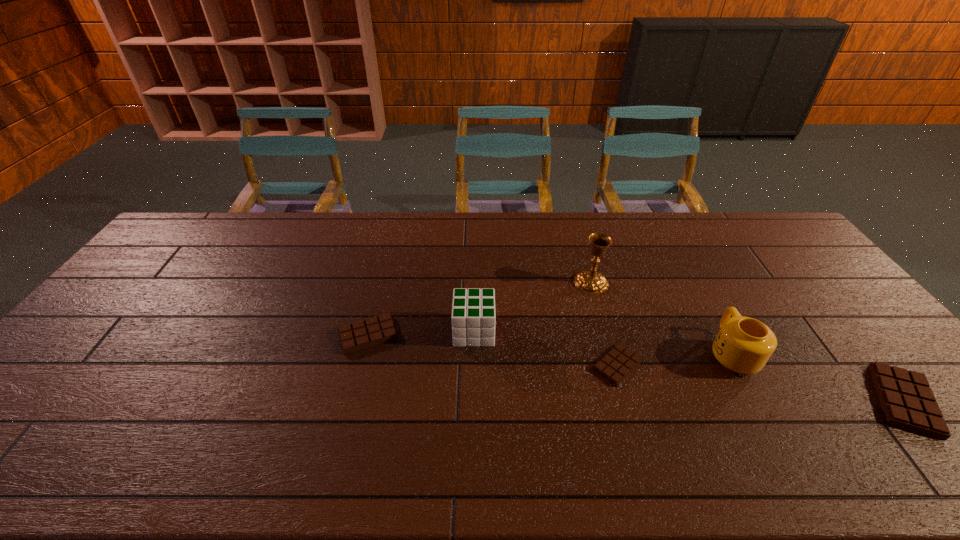
The height and width of the screenshot is (540, 960). In the image, there is a desktop. Identify the location of vacant space at the far right corner. (774, 224).

Locate an element on the screen. This screenshot has width=960, height=540. vacant region between the cube and the fifth object from left to right is located at coordinates (603, 342).

Find the location of a particular element. The image size is (960, 540). empty location between the farthest object and the shortest candy bar is located at coordinates (605, 324).

Where is `free space between the fifth object from right to left and the second candy bar from left to right`? This screenshot has width=960, height=540. free space between the fifth object from right to left and the second candy bar from left to right is located at coordinates (546, 348).

In order to click on vacant space that's between the fifth object from left to right and the chalice in this screenshot , I will do `click(661, 318)`.

Find the location of a particular element. The width and height of the screenshot is (960, 540). vacant area that lies between the second object from left to right and the mug is located at coordinates (603, 342).

Locate an element on the screen. The width and height of the screenshot is (960, 540). vacant area that lies between the second object from right to left and the tallest object is located at coordinates (661, 318).

At what (x,y) coordinates should I click in order to perform the action: click on vacant area between the cube and the farthest object. Please return your answer as a coordinate pair (x, y). The image size is (960, 540). Looking at the image, I should click on (533, 307).

In order to click on empty location between the mug and the second tallest candy bar in this screenshot , I will do `click(550, 344)`.

Locate which object ranks second in proximity to the second candy bar from left to right. Please provide its 2D coordinates. Your answer should be formatted as a tuple, i.e. [(x, y)], where the tuple contains the x and y coordinates of a point satisfying the conditions above.

[(591, 282)]